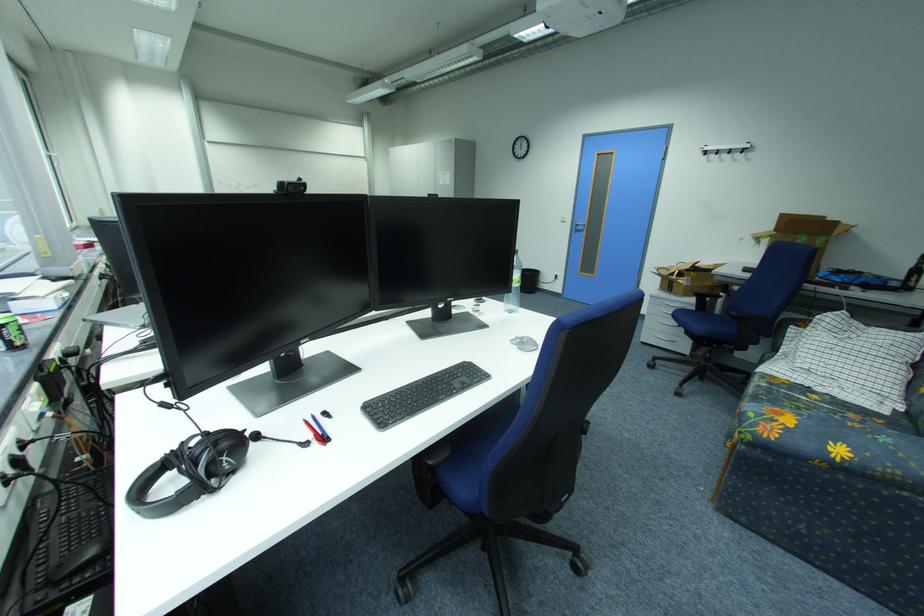
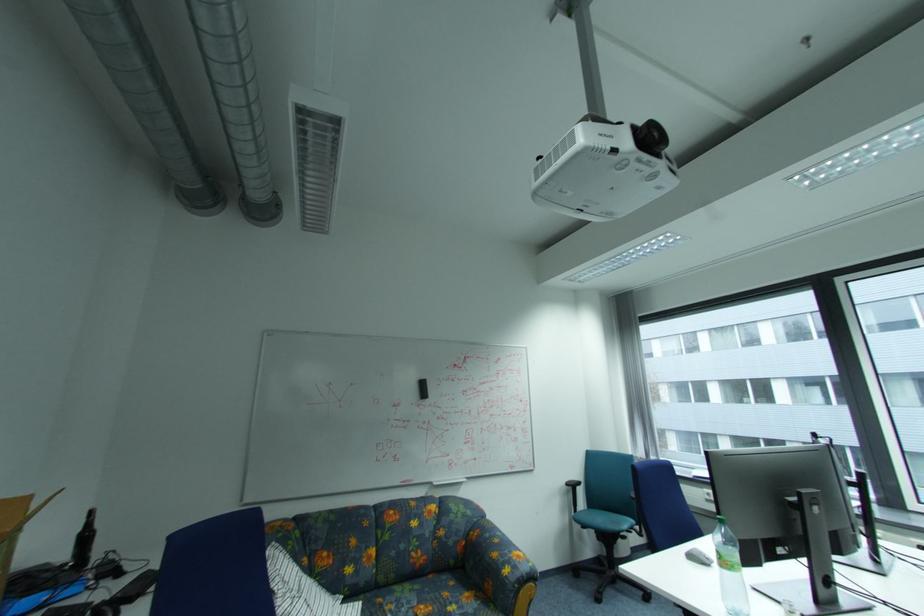
Question: I am providing you with two images of the same scene from different viewpoints. Which of the following objects are not visible in image2?

Choices:
 (A) dark glass bottle
 (B) floral sofa armrest
 (C) red pen
 (D) green leaf pillow

Answer: (C)